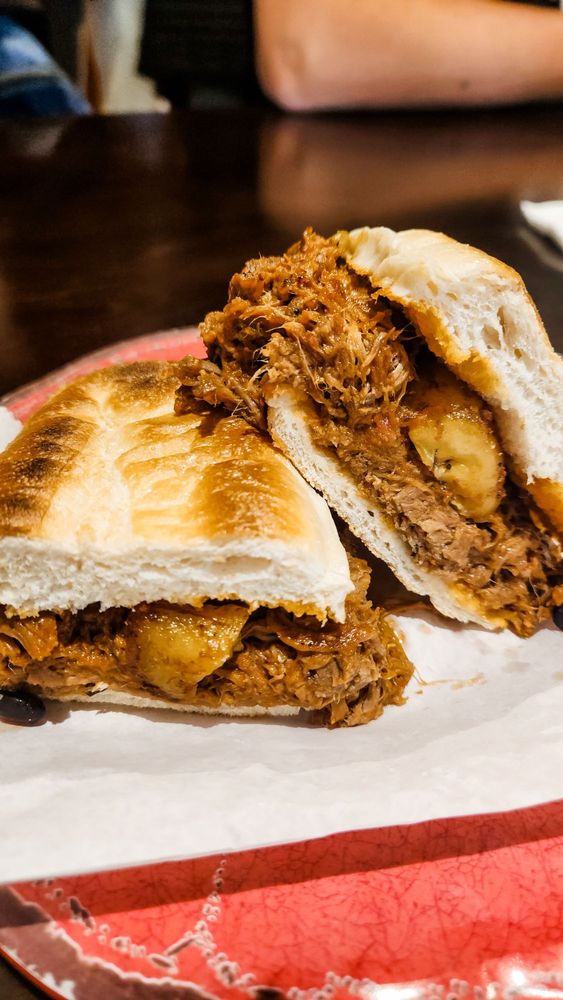
This screenshot has height=1000, width=563. I want to click on crumb, so click(476, 678), click(432, 687).